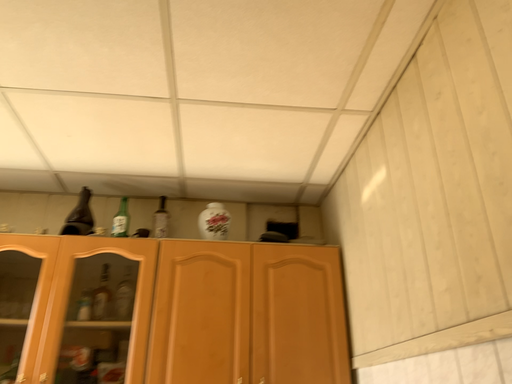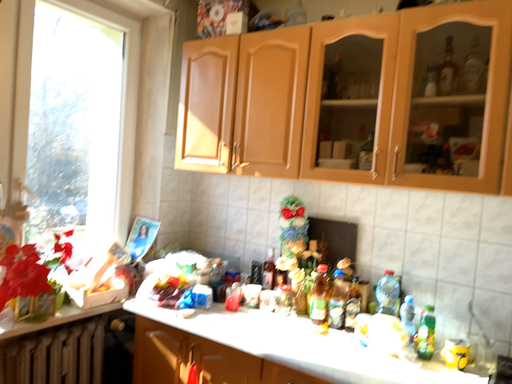
Question: Which way did the camera rotate in the video?

Choices:
 (A) rotated right
 (B) rotated left

Answer: (B)